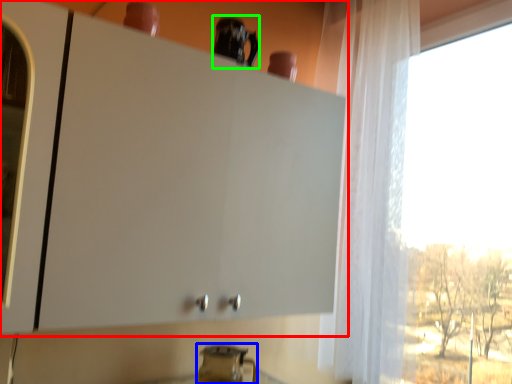
Question: Considering the real-world distances, which object is farthest from cabinetry (highlighted by a red box)? appliance (highlighted by a blue box) or appliance (highlighted by a green box)?

Choices:
 (A) appliance
 (B) appliance

Answer: (A)